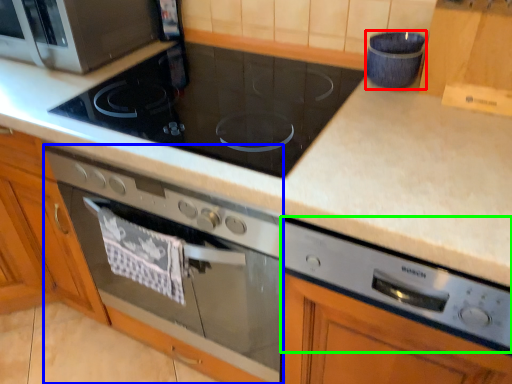
Question: Which object is positioned farthest from appliance (highlighted by a red box)? Select from home appliance (highlighted by a blue box) and appliance (highlighted by a green box).

Choices:
 (A) home appliance
 (B) appliance

Answer: (A)